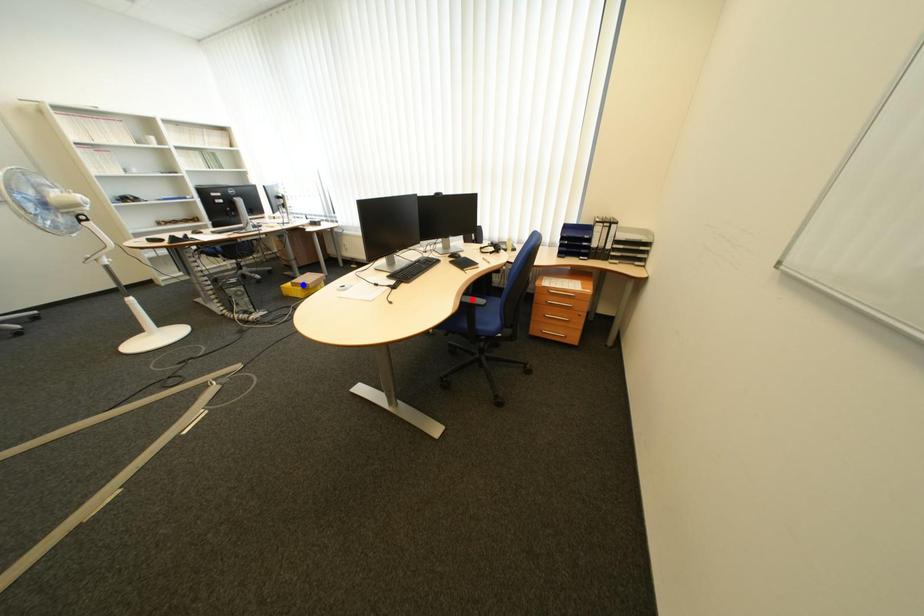
Question: In the image, two points are highlighted. Which point is nearer to the camera? Reply with the corresponding letter.

Choices:
 (A) blue point
 (B) red point

Answer: (B)